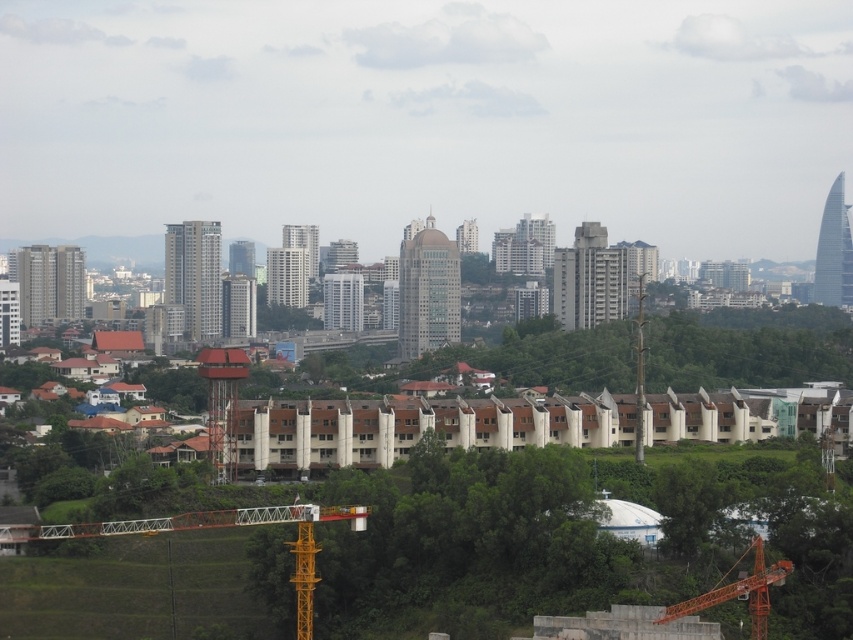
Question: Which point is farther from the camera taking this photo?

Choices:
 (A) (305, 538)
 (B) (672, 612)

Answer: (B)

Question: Is orange metallic crane at lower left in front of orange metallic crane at lower right?

Choices:
 (A) no
 (B) yes

Answer: (B)

Question: Which point is farther to the camera?

Choices:
 (A) orange metallic crane at lower left
 (B) orange metallic crane at lower right

Answer: (B)

Question: Which object appears closest to the camera in this image?

Choices:
 (A) orange metallic crane at lower right
 (B) orange metallic crane at lower left

Answer: (B)

Question: Does orange metallic crane at lower left have a greater width compared to orange metallic crane at lower right?

Choices:
 (A) yes
 (B) no

Answer: (A)

Question: Can you confirm if orange metallic crane at lower left is smaller than orange metallic crane at lower right?

Choices:
 (A) yes
 (B) no

Answer: (B)